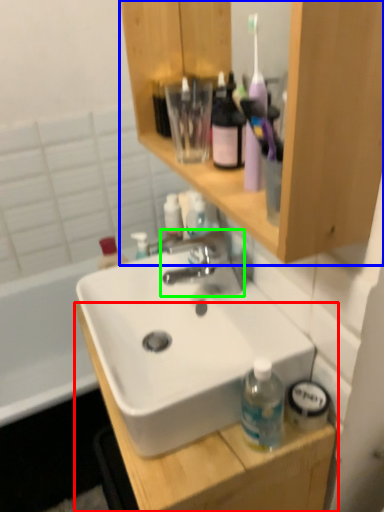
Question: Considering the real-world distances, which object is closest to cabinetry (highlighted by a red box)? bathroom cabinet (highlighted by a blue box) or tap (highlighted by a green box).

Choices:
 (A) bathroom cabinet
 (B) tap

Answer: (B)